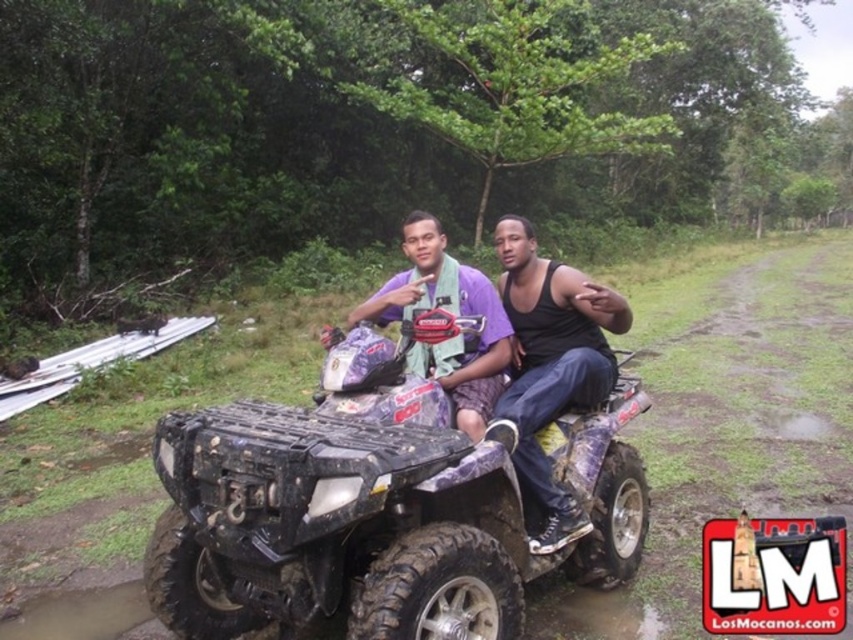
Is matte purple quad bike at center above purple matte shirt at center?

No.

Between matte purple quad bike at center and purple matte shirt at center, which one has less height?

purple matte shirt at center

Is point (495, 349) positioned behind point (508, 326)?

No, (495, 349) is closer to viewer.

I want to click on matte purple quad bike at center, so click(515, 349).

Is matte purple quad bike at center to the left of black matte tank top at center from the viewer's perspective?

Correct, you'll find matte purple quad bike at center to the left of black matte tank top at center.

Can you confirm if matte purple quad bike at center is taller than black matte tank top at center?

Incorrect, matte purple quad bike at center's height is not larger of black matte tank top at center's.

Who is more distant from viewer, (532, 488) or (524, 342)?

Answer: Positioned behind is point (524, 342).

The width and height of the screenshot is (853, 640). Find the location of `matte purple quad bike at center`. matte purple quad bike at center is located at coordinates (515, 349).

Does black matte tank top at center appear under purple matte shirt at center?

Correct, black matte tank top at center is located below purple matte shirt at center.

Which is more to the right, black matte tank top at center or purple matte shirt at center?

black matte tank top at center

Locate an element on the screen. This screenshot has height=640, width=853. black matte tank top at center is located at coordinates (550, 365).